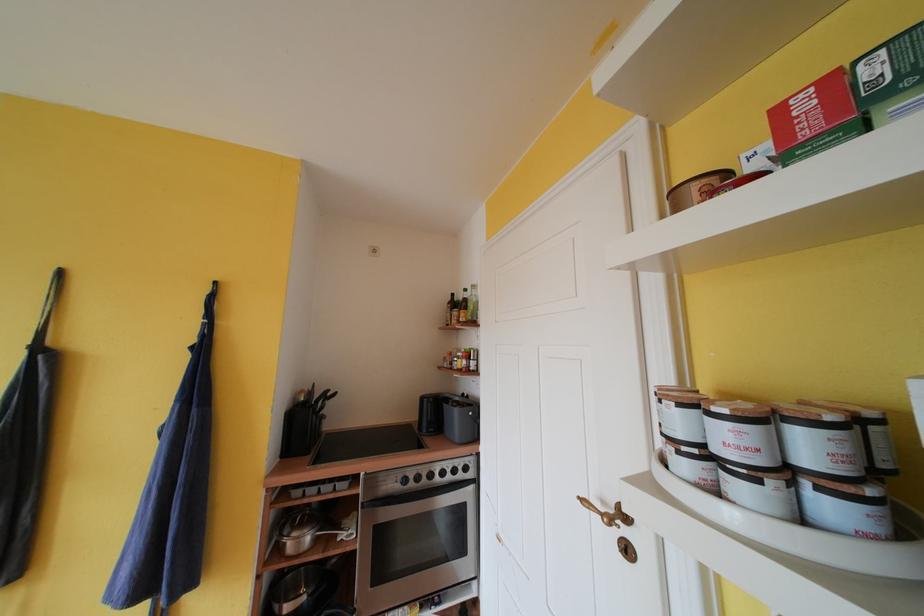
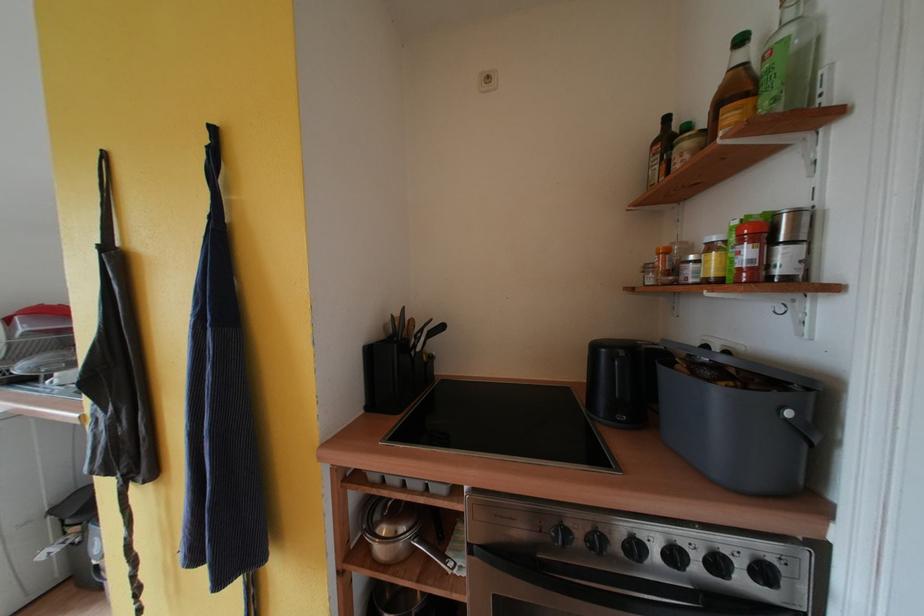
In the second image, find the point that corresponds to pixel 482 300 in the first image.

(817, 28)